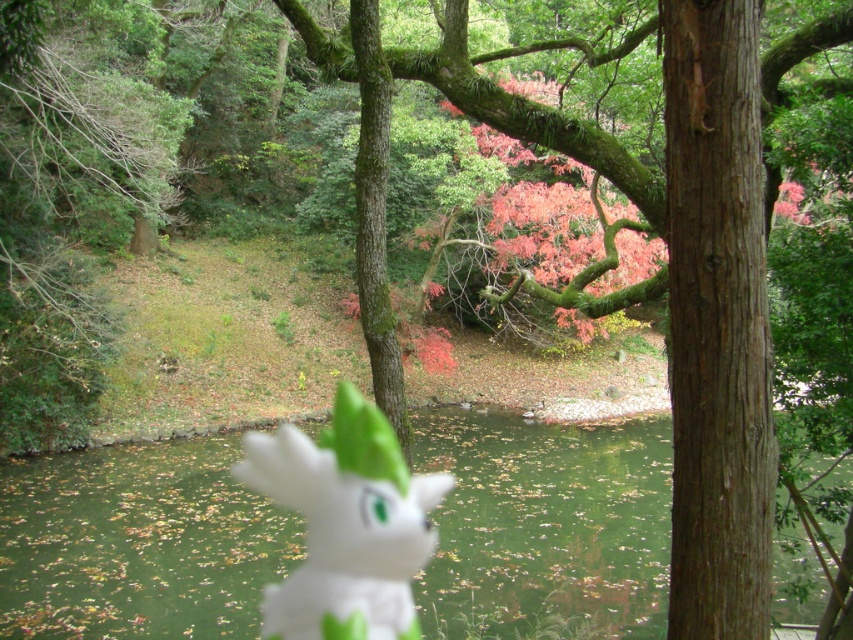
Question: Is green matte lake at center wider than green mossy branch at upper center?

Choices:
 (A) no
 (B) yes

Answer: (B)

Question: Among these objects, which one is farthest from the camera?

Choices:
 (A) white matte plush at center
 (B) green mossy branch at upper center

Answer: (B)

Question: Is green matte lake at center smaller than white matte plush at center?

Choices:
 (A) no
 (B) yes

Answer: (B)

Question: Is white matte plush at center thinner than green mossy branch at upper center?

Choices:
 (A) yes
 (B) no

Answer: (A)

Question: Which of the following is the closest to the observer?

Choices:
 (A) (561, 484)
 (B) (524, 252)
 (C) (241, 464)

Answer: (A)

Question: Based on their relative distances, which object is nearer to the green mossy branch at upper center?

Choices:
 (A) white matte plush at center
 (B) green matte lake at center

Answer: (A)